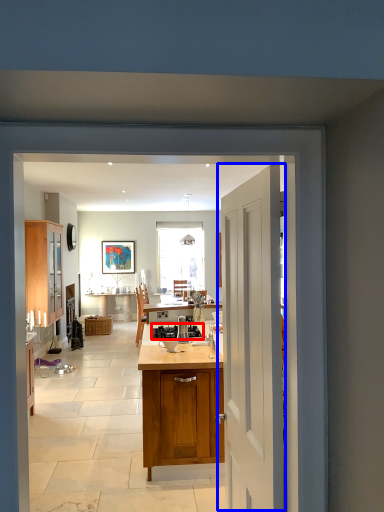
Question: Which of the following is the closest to the observer, gas stove (highlighted by a red box) or door (highlighted by a blue box)?

Choices:
 (A) gas stove
 (B) door

Answer: (B)